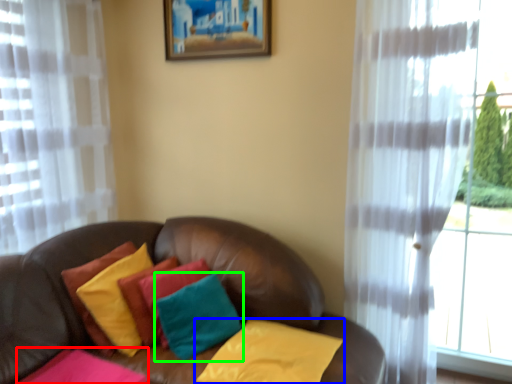
Question: Which is nearer to the pillow (highlighted by a red box)? pillow (highlighted by a blue box) or pillow (highlighted by a green box).

Choices:
 (A) pillow
 (B) pillow

Answer: (B)